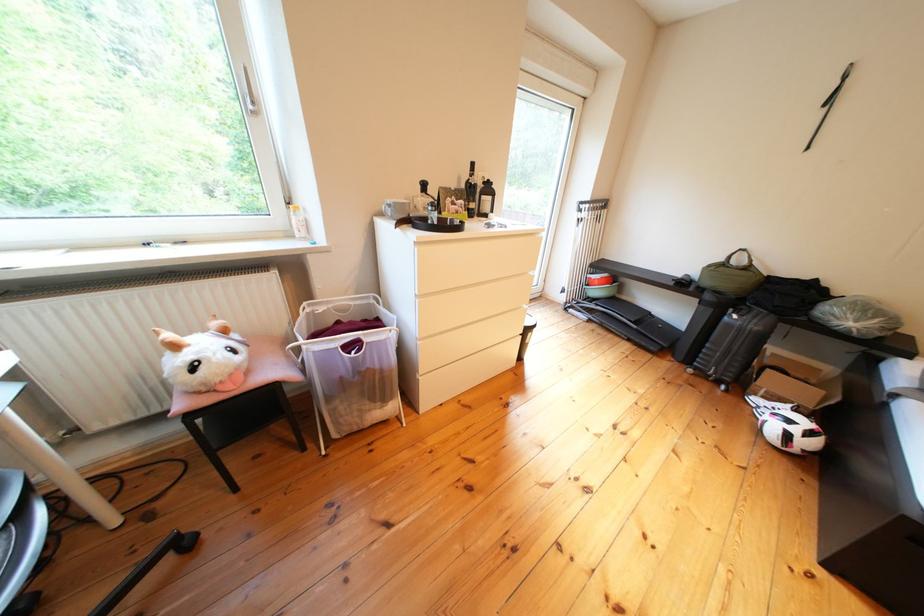
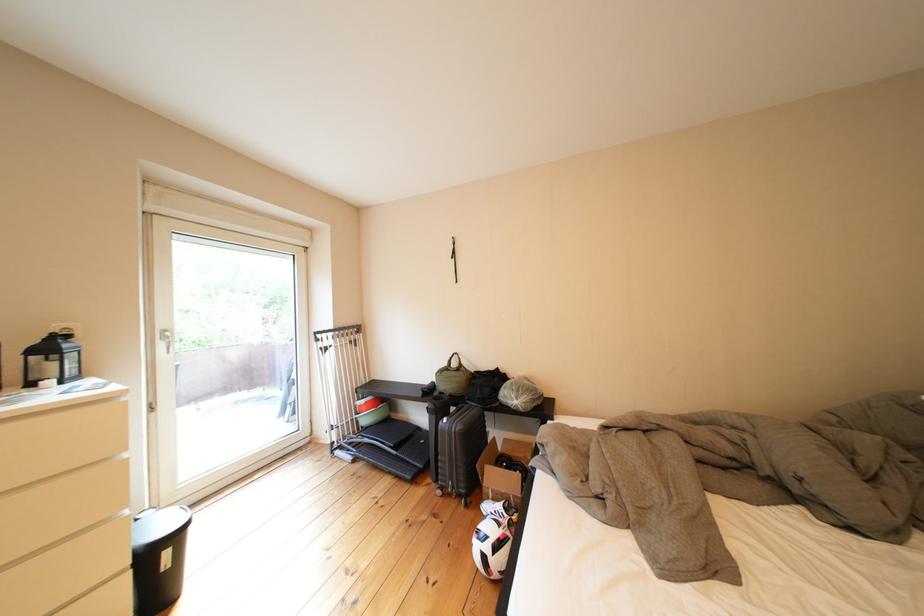
Locate, in the second image, the point that corresponds to [759,254] in the first image.

(469, 358)